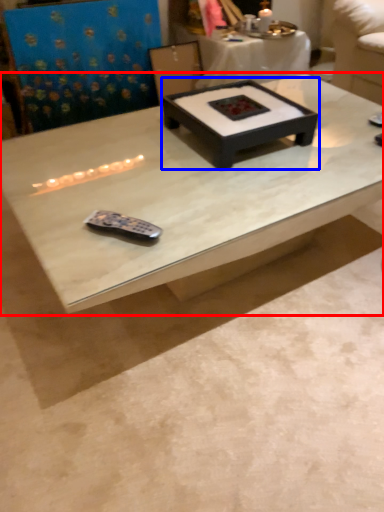
Question: Among these objects, which one is farthest to the camera, coffee table (highlighted by a red box) or coffee table (highlighted by a blue box)?

Choices:
 (A) coffee table
 (B) coffee table

Answer: (B)